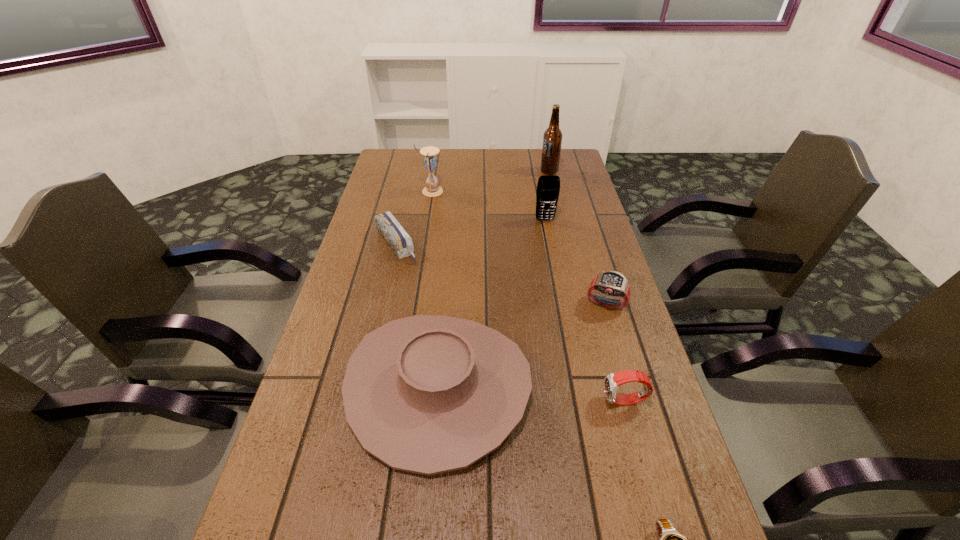
Find the location of `object that is positioned at the far edge`. object that is positioned at the far edge is located at coordinates (552, 139).

Locate an element on the screen. This screenshot has width=960, height=540. hourglass that is at the left edge is located at coordinates (430, 161).

This screenshot has width=960, height=540. Identify the location of cowboy hat at the left edge. (427, 394).

This screenshot has width=960, height=540. I want to click on pencil box at the left edge, so click(x=401, y=243).

Identify the location of beer bottle positioned at the right edge. The image size is (960, 540). (552, 139).

Identify the location of cellular telephone at the right edge. This screenshot has width=960, height=540. (548, 188).

Identify the location of object present at the far right corner. (552, 139).

Locate an element on the screen. vacant space at the far edge of the desktop is located at coordinates (519, 172).

I want to click on vacant space at the left edge, so click(403, 219).

Locate an element on the screen. This screenshot has width=960, height=540. vacant region at the right edge of the desktop is located at coordinates (566, 190).